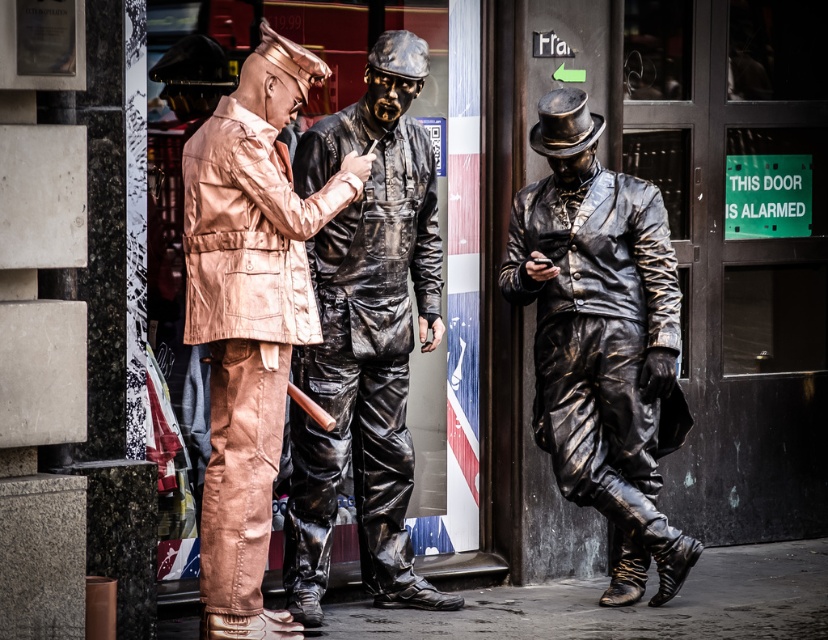
Consider the image. You are a fashion designer observing the three individuals in the scene. You need to determine which of the two central outfits, the shiny black suit at center or the shiny bronze jacket at center, would require more fabric to create based on their size. Which one would need more material?

The shiny black suit at center is taller than the shiny bronze jacket at center, so it would require more fabric to create.

You are an event organizer who needs to arrange these two items in a narrow corridor that can only accommodate items with a combined width of 1.5 meters. Given that the shiny black suit at center is narrower than the shiny bronze statue at center, can both fit together in the corridor?

The shiny black suit at center is narrower than the shiny bronze statue at center. If their combined width is less than 1.5 meters, they can fit. However, without knowing the exact widths, we cannot confirm. Please measure both items to ensure their total width does not exceed 1.5 meters.

You are a photographer trying to capture a photo of both point (623, 218) and point (210, 285) in the scene. Which point is closer to your camera lens?

Point (623, 218) is further to the viewer than point (210, 285), so the point closer to the camera lens is point (210, 285).